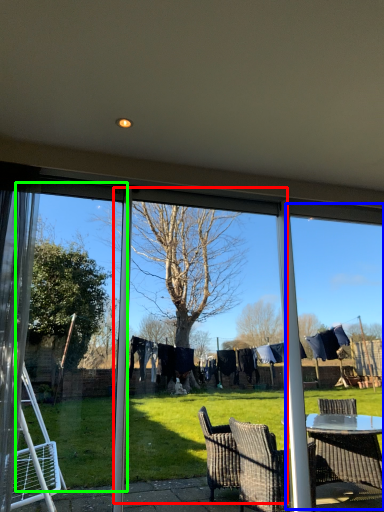
Question: Based on their relative distances, which object is farther from screen door (highlighted by a red box)? Choose from window frame (highlighted by a blue box) and screen door (highlighted by a green box).

Choices:
 (A) window frame
 (B) screen door

Answer: (A)